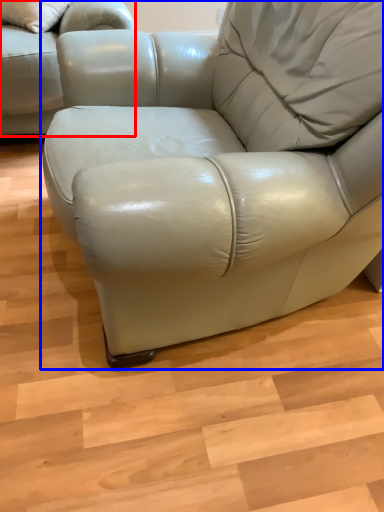
Question: Which point is further to the camera, studio couch (highlighted by a red box) or table (highlighted by a blue box)?

Choices:
 (A) studio couch
 (B) table

Answer: (A)